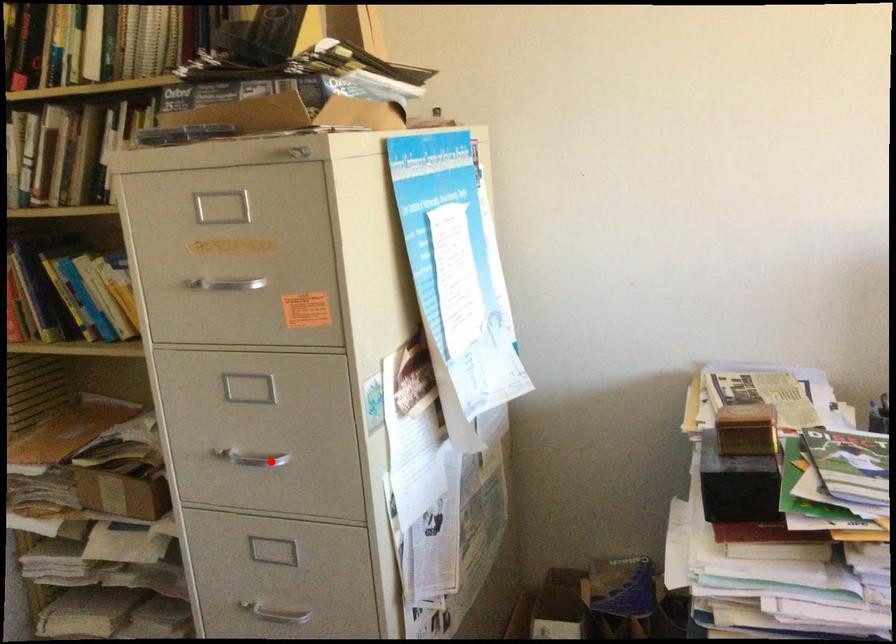
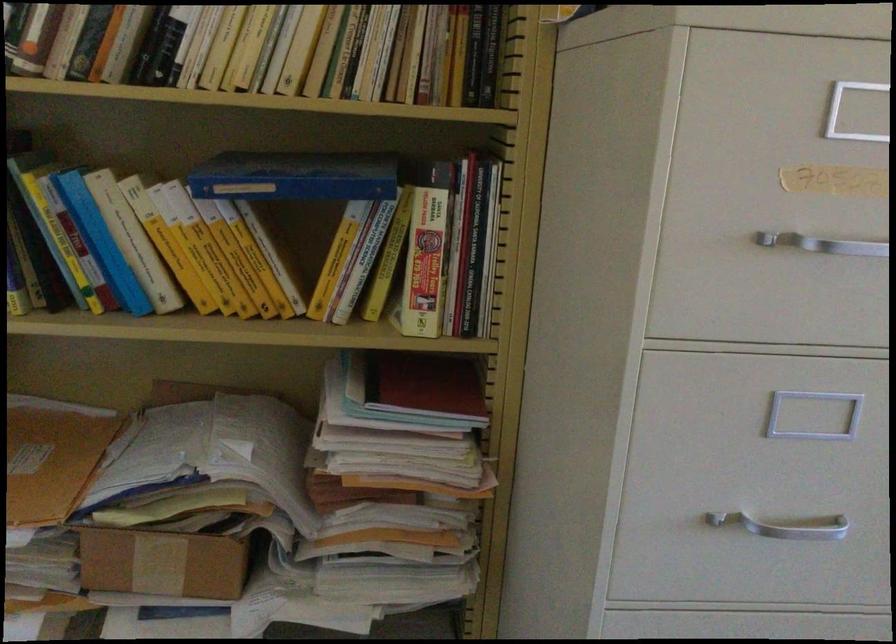
The point at the highlighted location is marked in the first image. Where is the corresponding point in the second image?

(784, 526)